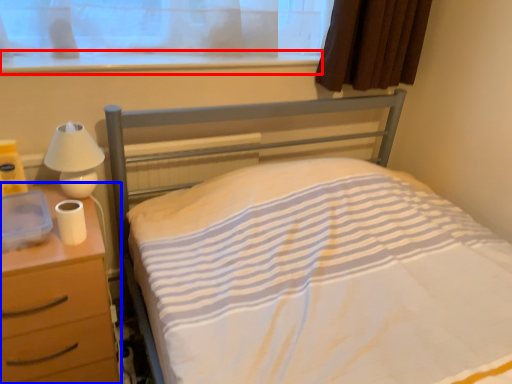
Question: Which point is further to the camera, window sill (highlighted by a red box) or nightstand (highlighted by a blue box)?

Choices:
 (A) window sill
 (B) nightstand

Answer: (A)